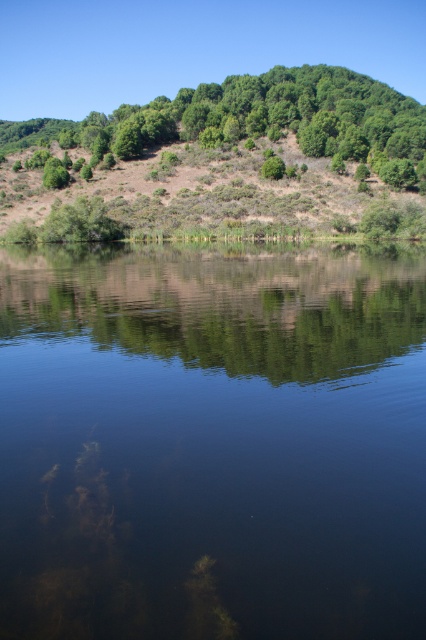
Question: Where is transparent water at center located in relation to green leafy hillside at upper center in the image?

Choices:
 (A) right
 (B) left

Answer: (A)

Question: Which point is farther to the camera?

Choices:
 (A) green leafy hillside at upper center
 (B) transparent water at center

Answer: (A)

Question: Is transparent water at center thinner than green leafy hillside at upper center?

Choices:
 (A) no
 (B) yes

Answer: (B)

Question: Which of the following is the farthest from the observer?

Choices:
 (A) transparent water at center
 (B) green leafy hillside at upper center

Answer: (B)

Question: Is transparent water at center thinner than green leafy hillside at upper center?

Choices:
 (A) yes
 (B) no

Answer: (A)